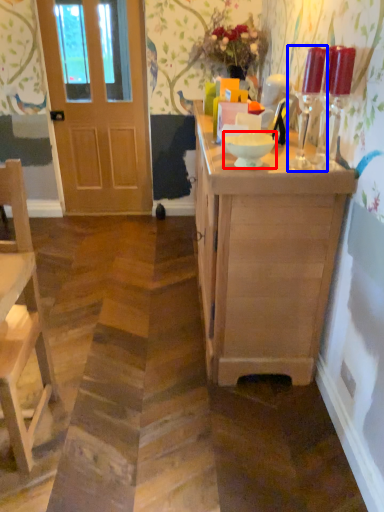
Question: Which of the following is the farthest to the observer, bowl (highlighted by a red box) or candle holder (highlighted by a blue box)?

Choices:
 (A) bowl
 (B) candle holder

Answer: (A)